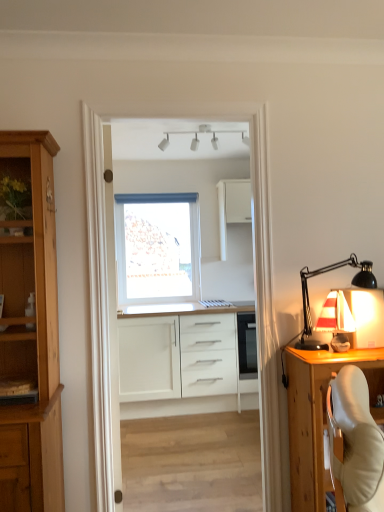
Question: Considering the positions of point (117, 408) and point (322, 313), is point (117, 408) closer or farther from the camera than point (322, 313)?

Choices:
 (A) closer
 (B) farther

Answer: (B)

Question: Considering the positions of white glossy door at center and matte white sailboat at right in the image, is white glossy door at center taller or shorter than matte white sailboat at right?

Choices:
 (A) tall
 (B) short

Answer: (A)

Question: Estimate the real-world distances between objects in this image. Which object is closer to the wooden cabinet at right, acting as the 2th cabinetry starting from the bottom?

Choices:
 (A) white glossy cabinet at center
 (B) white matte cabinet at center, the second cabinetry when ordered from front to back
 (C) white matte track lights at upper center, the first lamp in the left-to-right sequence
 (D) matte white sailboat at right
 (E) white glossy door at center

Answer: (D)

Question: Which object is the closest to the wooden cabinet at right, arranged as the 1th cabinetry when viewed from the front?

Choices:
 (A) white matte cabinet at upper center, positioned as the third cabinetry in bottom-to-top order
 (B) matte white sailboat at right
 (C) white glossy cabinet at center
 (D) white glossy door at center
 (E) white matte cabinet at center, the 3th cabinetry in the top-to-bottom sequence

Answer: (B)